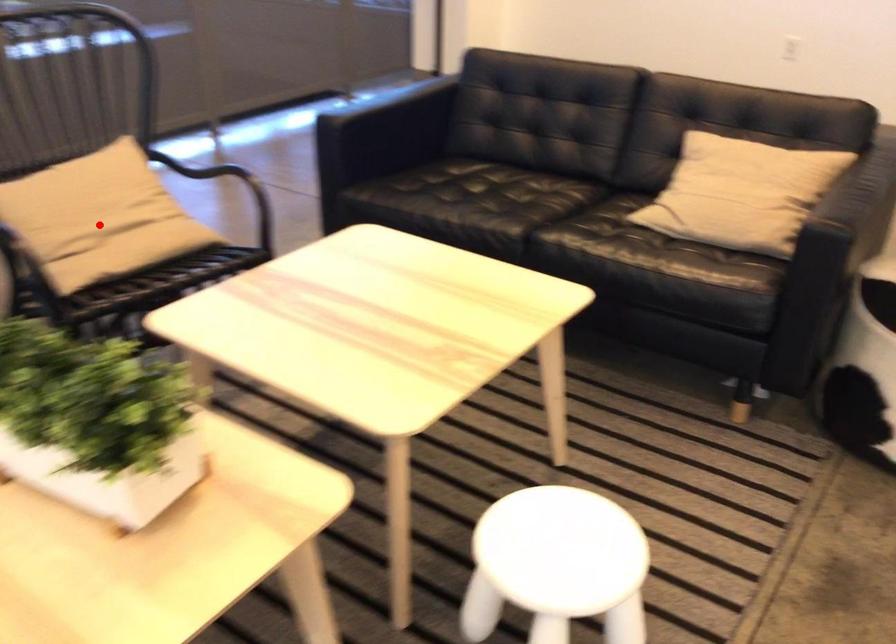
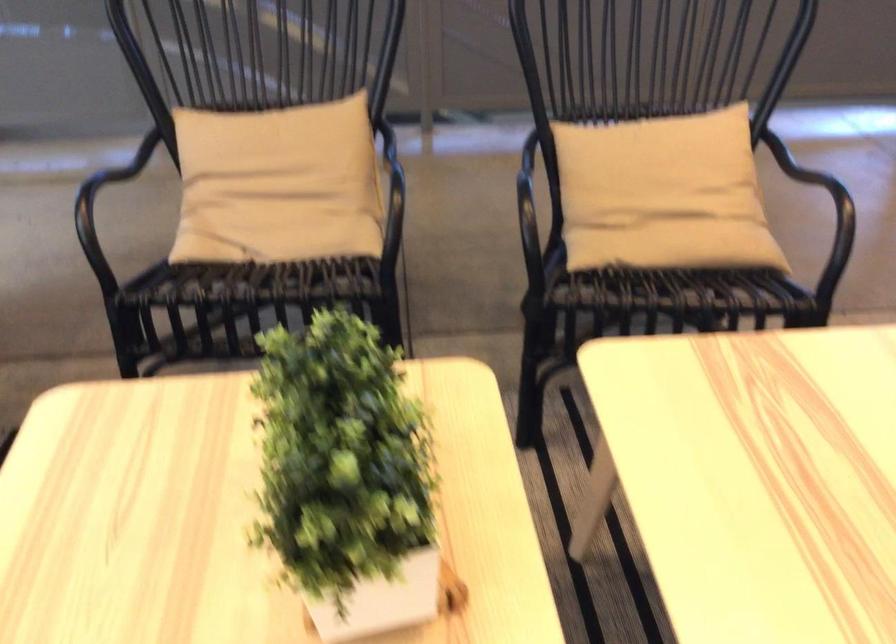
Question: I am providing you with two images of the same scene from different viewpoints. A red point is marked on the first image. Is the red point's position out of view in image 2?

Choices:
 (A) Yes
 (B) No

Answer: (B)